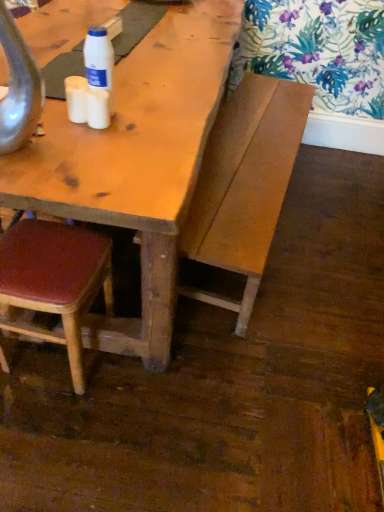
Question: Considering the relative sizes of white plastic bottle at upper center and white matte cup at center, placed as the first coffee cup when sorted from left to right, in the image provided, is white plastic bottle at upper center shorter than white matte cup at center, placed as the first coffee cup when sorted from left to right,?

Choices:
 (A) yes
 (B) no

Answer: (B)

Question: Is white plastic bottle at upper center at the left side of white matte cup at center, placed as the first coffee cup when sorted from left to right?

Choices:
 (A) yes
 (B) no

Answer: (B)

Question: Can you confirm if white plastic bottle at upper center is positioned to the right of white matte cup at center, arranged as the second coffee cup when viewed from the right?

Choices:
 (A) no
 (B) yes

Answer: (B)

Question: Is white plastic bottle at upper center positioned beyond the bounds of white matte cup at center, arranged as the second coffee cup when viewed from the right?

Choices:
 (A) yes
 (B) no

Answer: (A)

Question: Does white plastic bottle at upper center have a greater width compared to white matte cup at center, arranged as the second coffee cup when viewed from the right?

Choices:
 (A) no
 (B) yes

Answer: (B)

Question: Looking at their shapes, would you say wooden bench at center is wider or thinner than white matte cup at center, placed as the first coffee cup when sorted from left to right?

Choices:
 (A) thin
 (B) wide

Answer: (B)

Question: Is wooden bench at center situated inside white matte cup at center, arranged as the second coffee cup when viewed from the right, or outside?

Choices:
 (A) outside
 (B) inside

Answer: (A)

Question: Is wooden bench at center taller or shorter than white matte cup at center, arranged as the second coffee cup when viewed from the right?

Choices:
 (A) short
 (B) tall

Answer: (B)

Question: Is point (258, 95) positioned closer to the camera than point (72, 96)?

Choices:
 (A) farther
 (B) closer

Answer: (A)

Question: Is point (94, 74) closer or farther from the camera than point (107, 95)?

Choices:
 (A) closer
 (B) farther

Answer: (A)

Question: Considering the relative positions of white plastic bottle at upper center and white matte coffee cup at upper left, arranged as the 1th coffee cup when viewed from the right, in the image provided, is white plastic bottle at upper center to the left or to the right of white matte coffee cup at upper left, arranged as the 1th coffee cup when viewed from the right,?

Choices:
 (A) left
 (B) right

Answer: (A)

Question: Considering the positions of white plastic bottle at upper center and white matte coffee cup at upper left, arranged as the 1th coffee cup when viewed from the right, in the image, is white plastic bottle at upper center taller or shorter than white matte coffee cup at upper left, arranged as the 1th coffee cup when viewed from the right,?

Choices:
 (A) short
 (B) tall

Answer: (B)

Question: Considering their positions, is white plastic bottle at upper center located in front of or behind white matte coffee cup at upper left, the second coffee cup positioned from the left?

Choices:
 (A) front
 (B) behind

Answer: (A)

Question: From the image's perspective, is wooden bench at center above or below leatherette chair at lower left?

Choices:
 (A) below
 (B) above

Answer: (B)

Question: Is point (268, 159) closer or farther from the camera than point (82, 387)?

Choices:
 (A) farther
 (B) closer

Answer: (A)